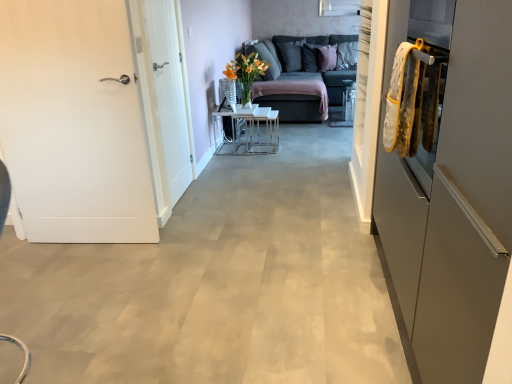
What is the approximate height of white wood door at left, which appears as the first door when viewed from the right?

4.58 feet.

The image size is (512, 384). Describe the element at coordinates (327, 57) in the screenshot. I see `pink fabric pillow at center, which is the first pillow from right to left` at that location.

What is the approximate width of metallic silver table at center?

It is 16.24 inches.

The width and height of the screenshot is (512, 384). Describe the element at coordinates (249, 131) in the screenshot. I see `metallic silver table at center` at that location.

Describe the element at coordinates (455, 205) in the screenshot. The height and width of the screenshot is (384, 512). I see `matte gray cabinet at right` at that location.

What is the approximate width of dark gray fabric pillow at upper center, positioned as the first pillow in left-to-right order?

18.29 inches.

At what (x,y) coordinates should I click in order to perform the action: click on white wood door at left, which appears as the first door when viewed from the right. Please return your answer as a coordinate pair (x, y). The width and height of the screenshot is (512, 384). Looking at the image, I should click on (167, 96).

From a real-world perspective, is pink fabric pillow at center, arranged as the 2th pillow when viewed from the left, under white wood door at left, arranged as the 2th door when viewed from the left?

Yes.

Which of these two, pink fabric pillow at center, which is the first pillow from right to left, or white wood door at left, arranged as the 2th door when viewed from the left, is wider?

With larger width is pink fabric pillow at center, which is the first pillow from right to left.

Is point (329, 49) farther from viewer compared to point (167, 22)?

Yes, it is behind point (167, 22).

Do you think dark gray fabric pillow at upper center, the second pillow when ordered from right to left, is within white matte door at left, the second door from the right, or outside of it?

dark gray fabric pillow at upper center, the second pillow when ordered from right to left, is not enclosed by white matte door at left, the second door from the right.

Considering the relative positions of dark gray fabric pillow at upper center, positioned as the first pillow in left-to-right order, and white matte door at left, the second door from the right, in the image provided, is dark gray fabric pillow at upper center, positioned as the first pillow in left-to-right order, to the right of white matte door at left, the second door from the right, from the viewer's perspective?

Yes.

Measure the distance from dark gray fabric pillow at upper center, the second pillow when ordered from right to left, to white matte door at left, the second door from the right.

dark gray fabric pillow at upper center, the second pillow when ordered from right to left, is 13.95 feet away from white matte door at left, the second door from the right.

Is dark gray fabric pillow at upper center, positioned as the first pillow in left-to-right order, bigger than white matte door at left, which is the 1th door from left to right?

No, dark gray fabric pillow at upper center, positioned as the first pillow in left-to-right order, is not bigger than white matte door at left, which is the 1th door from left to right.

From the picture: Considering the relative positions of metallic silver table at center and dark gray fabric couch at center in the image provided, is metallic silver table at center in front of dark gray fabric couch at center?

Yes, it is in front of dark gray fabric couch at center.

Are metallic silver table at center and dark gray fabric couch at center far apart?

Indeed, metallic silver table at center is not near dark gray fabric couch at center.

You are a GUI agent. You are given a task and a screenshot of the screen. Output one action in this format:
    pyautogui.click(x=<x>, y=<y>)
    Task: Click on the table in front of the dark gray fabric couch at center
    Image resolution: width=512 pixels, height=384 pixels.
    Given the screenshot: What is the action you would take?
    pyautogui.click(x=249, y=131)

From a real-world perspective, is metallic silver table at center on dark gray fabric couch at center?

No, from a real-world perspective, metallic silver table at center is not on top of dark gray fabric couch at center.

Considering the relative sizes of dark gray fabric couch at center and pink fabric pillow at center, arranged as the 2th pillow when viewed from the left, in the image provided, is dark gray fabric couch at center thinner than pink fabric pillow at center, arranged as the 2th pillow when viewed from the left,?

No.

Is dark gray fabric couch at center facing away from pink fabric pillow at center, which is the first pillow from right to left?

Absolutely, dark gray fabric couch at center is directed away from pink fabric pillow at center, which is the first pillow from right to left.

What's the angular difference between dark gray fabric couch at center and pink fabric pillow at center, arranged as the 2th pillow when viewed from the left,'s facing directions?

The facing directions of dark gray fabric couch at center and pink fabric pillow at center, arranged as the 2th pillow when viewed from the left, are 46.2 degrees apart.

Is dark gray fabric couch at center beside pink fabric pillow at center, arranged as the 2th pillow when viewed from the left?

No, dark gray fabric couch at center is not beside pink fabric pillow at center, arranged as the 2th pillow when viewed from the left.

Which is less distant, (234, 136) or (503, 140)?

Positioned in front is point (503, 140).

In the scene shown: Can you see metallic silver table at center touching matte gray cabinet at right?

metallic silver table at center is not next to matte gray cabinet at right, and they're not touching.

In terms of width, does metallic silver table at center look wider or thinner when compared to matte gray cabinet at right?

Considering their sizes, metallic silver table at center looks slimmer than matte gray cabinet at right.

Can you confirm if matte gray cabinet at right is taller than white matte door at left, the second door from the right?

No.

Locate an element on the screen. cabinetry on the right of white matte door at left, the second door from the right is located at coordinates (455, 205).

From the image's perspective, which object appears higher, matte gray cabinet at right or white matte door at left, the second door from the right?

white matte door at left, the second door from the right, from the image's perspective.

Which is closer, (x=223, y=119) or (x=1, y=134)?

Point (x=223, y=119).

From the image's perspective, which is above, metallic silver table at center or white matte door at left, which is the 1th door from left to right?

metallic silver table at center is shown above in the image.

Is white matte door at left, which is the 1th door from left to right, surrounded by metallic silver table at center?

No, white matte door at left, which is the 1th door from left to right, is not a part of metallic silver table at center.

Image resolution: width=512 pixels, height=384 pixels. I want to click on the 1st door in front when counting from the pink fabric pillow at center, arranged as the 2th pillow when viewed from the left, so click(167, 96).

Locate an element on the screen. the 1st pillow to the right of the white matte door at left, the second door from the right, starting your count from the anchor is located at coordinates (291, 55).

Looking at the image, which one is located further to matte gray cabinet at right, pink fabric pillow at center, which is the first pillow from right to left, or white wood door at left, arranged as the 2th door when viewed from the left?

Among the two, pink fabric pillow at center, which is the first pillow from right to left, is located further to matte gray cabinet at right.

Which object lies nearer to the anchor point dark gray fabric pillow at upper center, the second pillow when ordered from right to left, pink fabric pillow at center, arranged as the 2th pillow when viewed from the left, or white wood door at left, arranged as the 2th door when viewed from the left?

pink fabric pillow at center, arranged as the 2th pillow when viewed from the left, is positioned closer to the anchor dark gray fabric pillow at upper center, the second pillow when ordered from right to left.

When comparing their distances from pink fabric pillow at center, arranged as the 2th pillow when viewed from the left, does dark gray fabric couch at center or white matte door at left, the second door from the right, seem further?

white matte door at left, the second door from the right, lies further to pink fabric pillow at center, arranged as the 2th pillow when viewed from the left, than the other object.

Considering their positions, is dark gray fabric couch at center positioned closer to dark gray fabric pillow at upper center, positioned as the first pillow in left-to-right order, than white wood door at left, arranged as the 2th door when viewed from the left?

dark gray fabric couch at center is closer to dark gray fabric pillow at upper center, positioned as the first pillow in left-to-right order.

From the image, which object appears to be nearer to dark gray fabric pillow at upper center, positioned as the first pillow in left-to-right order, matte gray cabinet at right or metallic silver table at center?

metallic silver table at center lies closer to dark gray fabric pillow at upper center, positioned as the first pillow in left-to-right order, than the other object.

Looking at the image, which one is located further to pink fabric pillow at center, arranged as the 2th pillow when viewed from the left, metallic silver table at center or dark gray fabric pillow at upper center, positioned as the first pillow in left-to-right order?

Based on the image, metallic silver table at center appears to be further to pink fabric pillow at center, arranged as the 2th pillow when viewed from the left.

Which object lies further to the anchor point matte gray cabinet at right, dark gray fabric couch at center or white wood door at left, which appears as the first door when viewed from the right?

Based on the image, dark gray fabric couch at center appears to be further to matte gray cabinet at right.

Based on their spatial positions, is metallic silver table at center or matte gray cabinet at right closer to dark gray fabric couch at center?

metallic silver table at center is positioned closer to the anchor dark gray fabric couch at center.

Find the location of a particular element. The height and width of the screenshot is (384, 512). table between white wood door at left, which appears as the first door when viewed from the right, and dark gray fabric pillow at upper center, positioned as the first pillow in left-to-right order, from front to back is located at coordinates (249, 131).

Where is `door positioned between white matte door at left, the second door from the right, and pink fabric pillow at center, which is the first pillow from right to left, from near to far`? The height and width of the screenshot is (384, 512). door positioned between white matte door at left, the second door from the right, and pink fabric pillow at center, which is the first pillow from right to left, from near to far is located at coordinates (167, 96).

I want to click on studio couch positioned between metallic silver table at center and dark gray fabric pillow at upper center, positioned as the first pillow in left-to-right order, from near to far, so click(303, 75).

Image resolution: width=512 pixels, height=384 pixels. What are the coordinates of `pillow positioned between white wood door at left, which appears as the first door when viewed from the right, and dark gray fabric pillow at upper center, the second pillow when ordered from right to left, from near to far` in the screenshot? It's located at (327, 57).